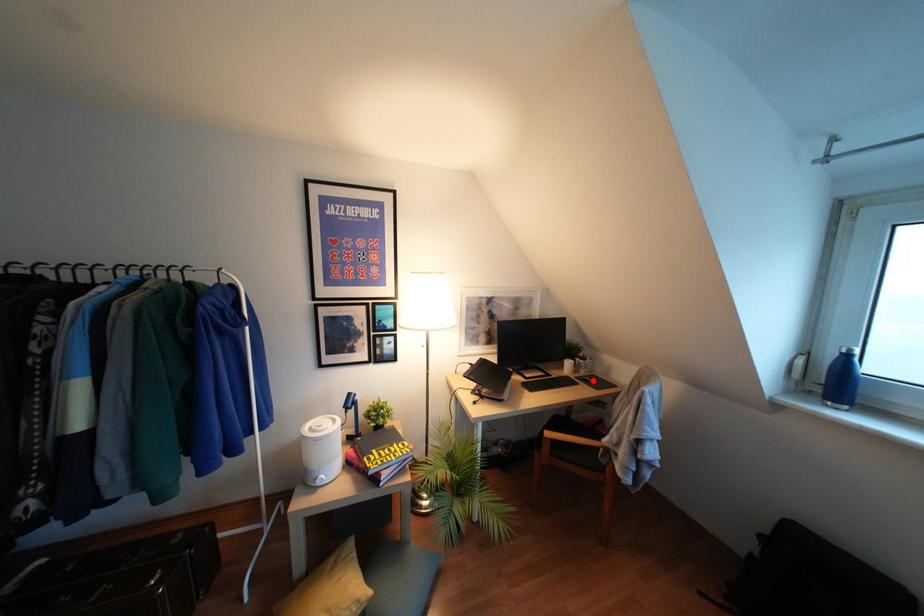
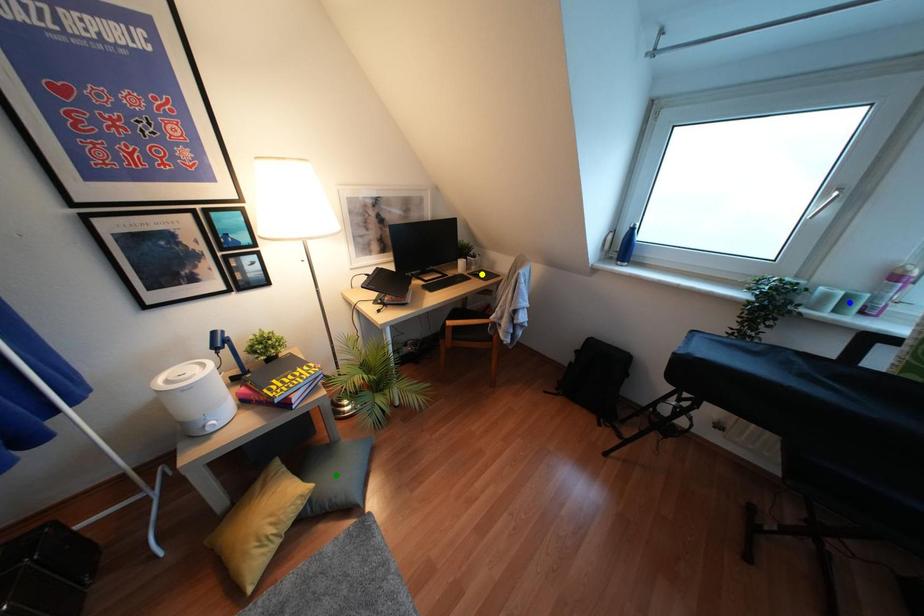
Question: I am providing you with two images of the same scene from different viewpoints. A red point is marked on the first image. You are given multiple points on the second image. Which point in image 2 represents the same 3d spot as the red point in image 1?

Choices:
 (A) yellow point
 (B) green point
 (C) blue point

Answer: (A)